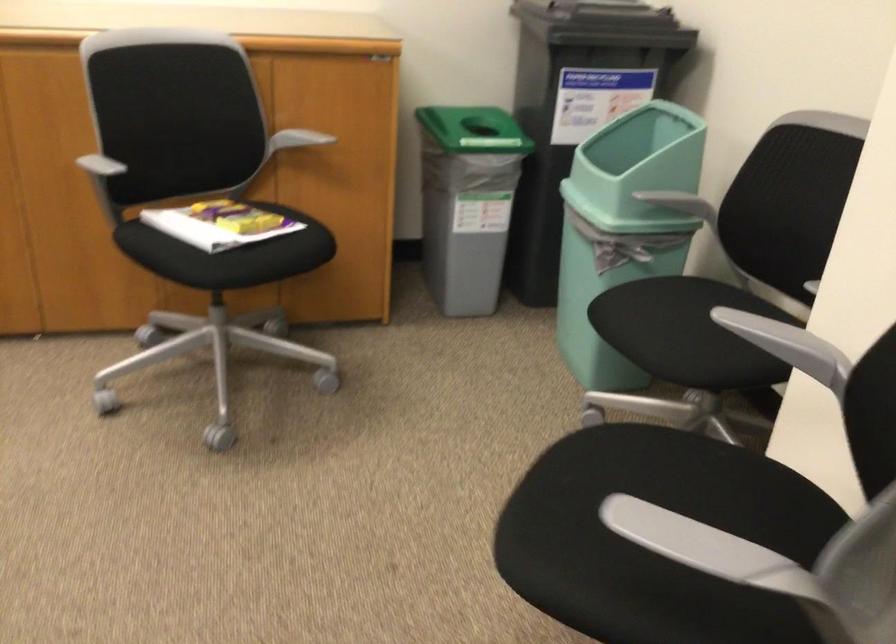
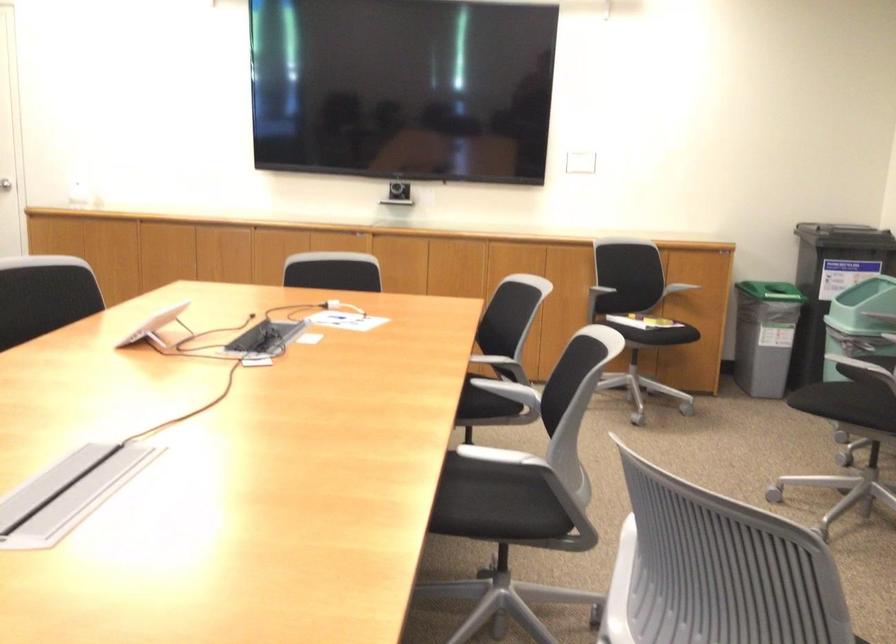
The point at (247, 319) is marked in the first image. Where is the corresponding point in the second image?

(647, 353)